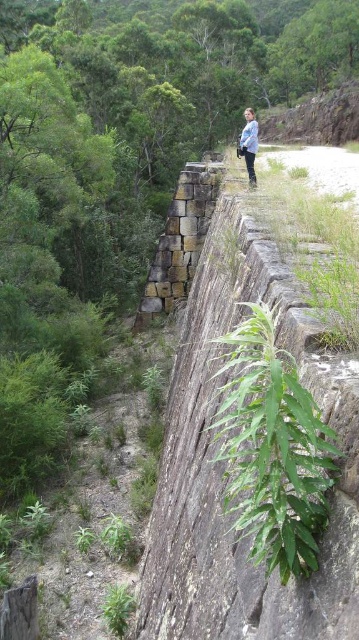
Question: Does brown rough stone at center lie behind blue denim jacket at upper center?

Choices:
 (A) yes
 (B) no

Answer: (A)

Question: Which of the following is the farthest from the observer?

Choices:
 (A) brown rough stone at center
 (B) blue denim jacket at upper center

Answer: (A)

Question: Which is farther from the green leafy plant at center?

Choices:
 (A) blue denim jacket at upper center
 (B) brown rough stone at center

Answer: (B)

Question: Observing the image, what is the correct spatial positioning of green leafy plant at center in reference to blue denim jacket at upper center?

Choices:
 (A) above
 (B) below

Answer: (B)

Question: Which is farther from the blue denim jacket at upper center?

Choices:
 (A) green leafy plant at center
 (B) brown rough stone at center

Answer: (A)

Question: Is green leafy plant at center thinner than brown rough stone at center?

Choices:
 (A) yes
 (B) no

Answer: (A)